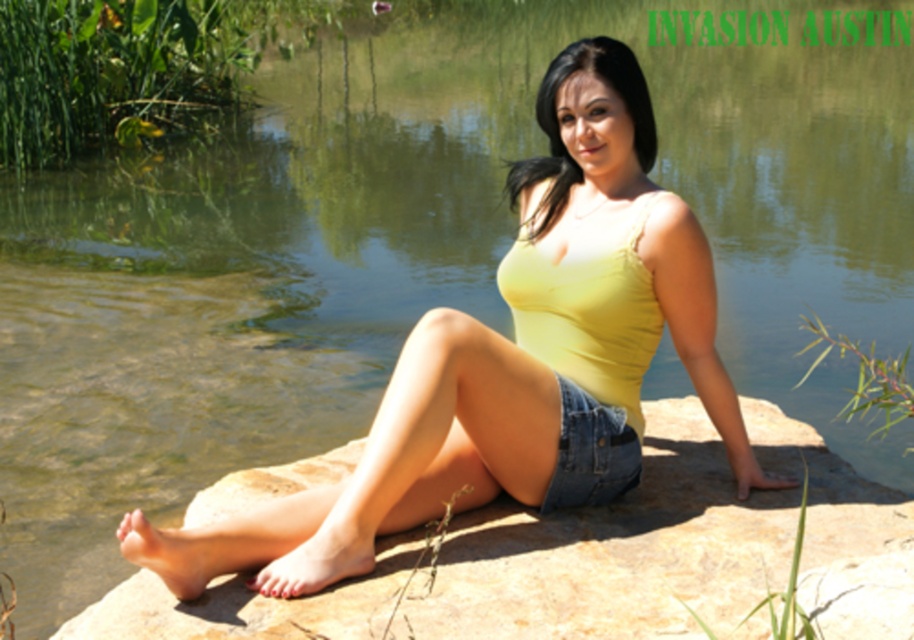
Question: Is brown textured rock at center smaller than denim shorts at center?

Choices:
 (A) no
 (B) yes

Answer: (A)

Question: Estimate the real-world distances between objects in this image. Which object is farther from the denim shorts at center?

Choices:
 (A) yellow matte tank top at center
 (B) brown textured rock at center

Answer: (B)

Question: Which point is closer to the camera?

Choices:
 (A) (540, 406)
 (B) (590, 497)

Answer: (A)

Question: Does yellow matte tank top at center have a larger size compared to brown textured rock at center?

Choices:
 (A) yes
 (B) no

Answer: (A)

Question: Among these points, which one is farthest from the camera?

Choices:
 (A) (700, 592)
 (B) (626, 456)

Answer: (B)

Question: Does yellow matte tank top at center come in front of brown textured rock at center?

Choices:
 (A) yes
 (B) no

Answer: (B)